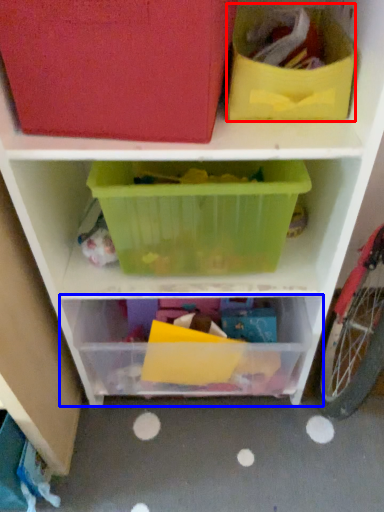
Question: Which object appears farthest to the camera in this image, storage box (highlighted by a red box) or shelf (highlighted by a blue box)?

Choices:
 (A) storage box
 (B) shelf

Answer: (B)